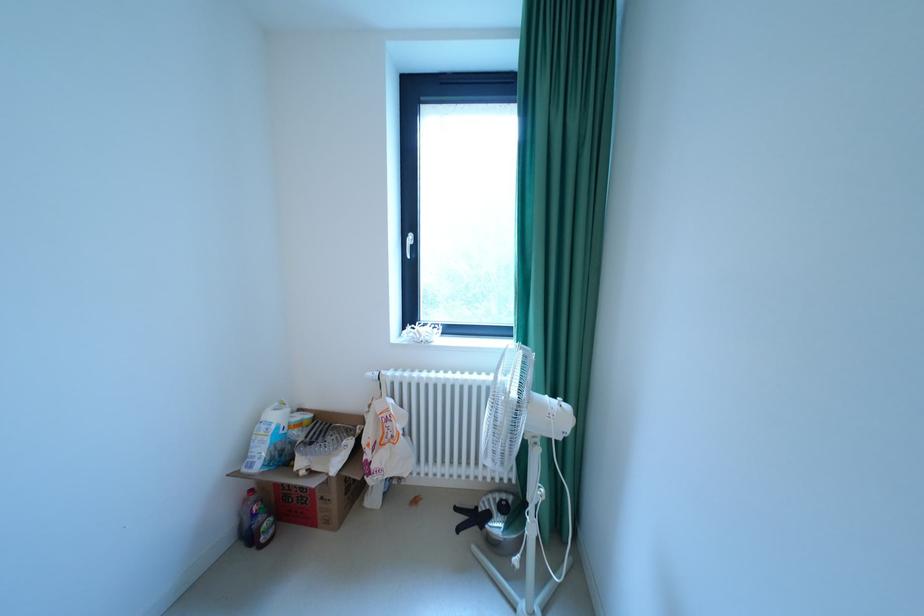
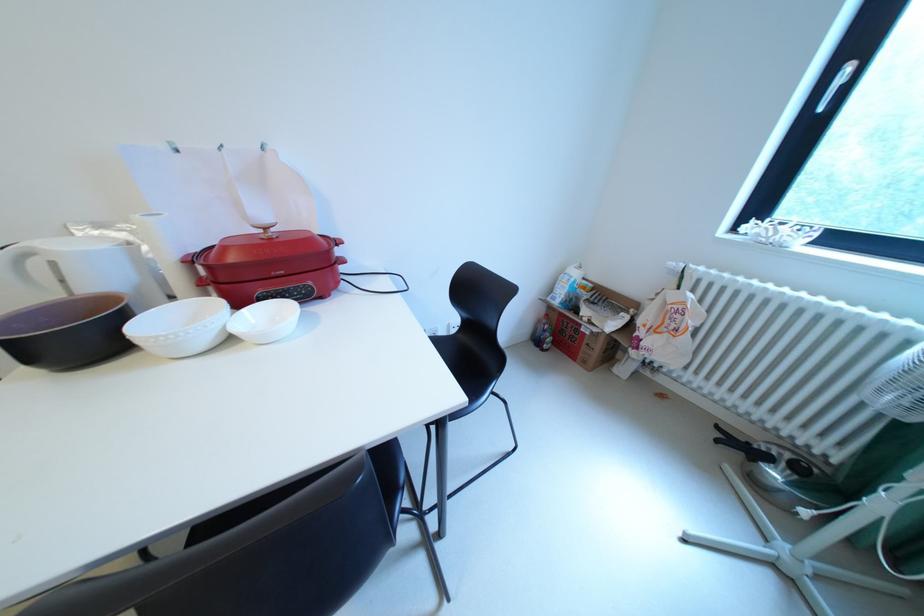
In the second image, find the point that corresponds to point 420,237 in the first image.

(859, 70)